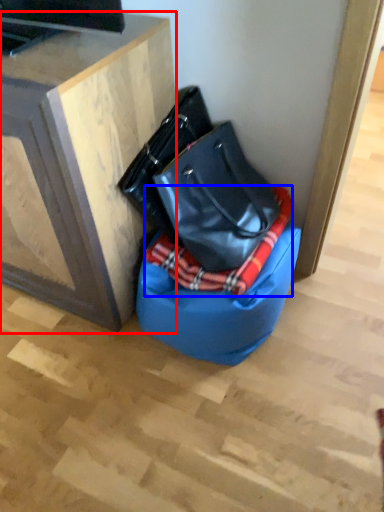
Question: Which object is closer to the camera taking this photo, furniture (highlighted by a red box) or blanket (highlighted by a blue box)?

Choices:
 (A) furniture
 (B) blanket

Answer: (A)